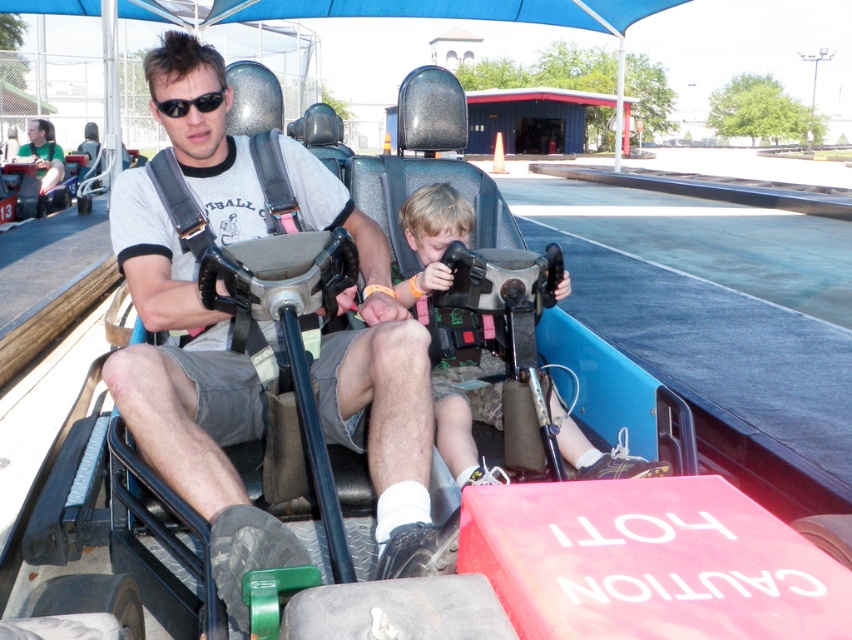
Question: Among these objects, which one is farthest from the camera?

Choices:
 (A) matte gray steering wheel at center
 (B) black matte sunglasses at upper center
 (C) camouflage shorts at center

Answer: (C)

Question: Can you confirm if matte gray steering wheel at center is thinner than black matte sunglasses at upper center?

Choices:
 (A) no
 (B) yes

Answer: (A)

Question: Is the position of matte gray steering wheel at center less distant than that of camouflage shorts at center?

Choices:
 (A) no
 (B) yes

Answer: (B)

Question: Can you confirm if matte gray steering wheel at center is thinner than black matte sunglasses at upper center?

Choices:
 (A) yes
 (B) no

Answer: (B)

Question: Which of the following is the closest to the observer?

Choices:
 (A) matte gray steering wheel at center
 (B) camouflage shorts at center

Answer: (A)

Question: Which of the following is the farthest from the observer?

Choices:
 (A) (162, 253)
 (B) (406, 280)

Answer: (B)